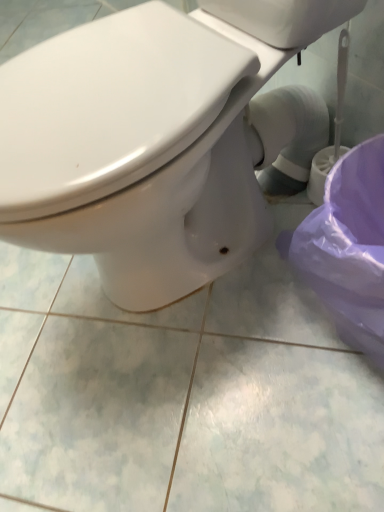
Identify the location of vacant area that lies between purple plastic potty at lower right and white glossy toilet at center. The height and width of the screenshot is (512, 384). (239, 352).